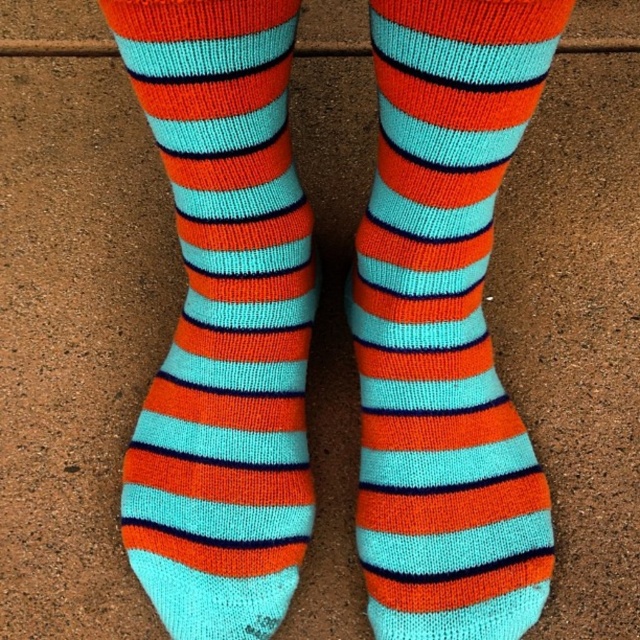
Can you confirm if knitted cotton sock at center is wider than knit socks at center?

Indeed, knitted cotton sock at center has a greater width compared to knit socks at center.

Which of these two, knitted cotton sock at center or knit socks at center, stands shorter?

knitted cotton sock at center is shorter.

Find the location of a particular element. This screenshot has height=640, width=640. knitted cotton sock at center is located at coordinates (445, 326).

Identify the location of knitted cotton sock at center. (445, 326).